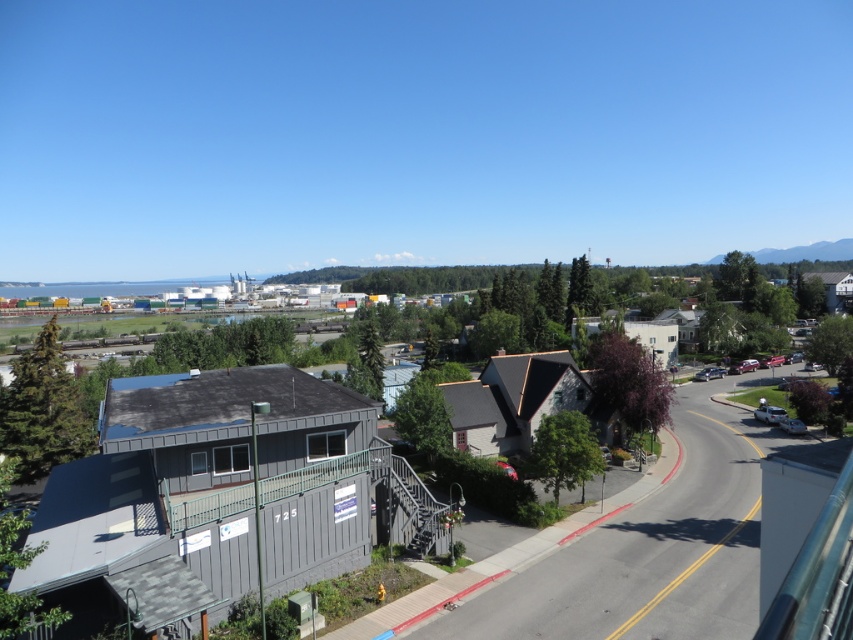
Question: Which point is farther to the camera?

Choices:
 (A) white glossy car at lower right
 (B) silver metallic sedan at lower right

Answer: (A)

Question: Does gray wood town at center lie in front of metallic silver sedan at center-right?

Choices:
 (A) yes
 (B) no

Answer: (A)

Question: Does metallic silver sedan at center-right have a lesser width compared to white glossy car at lower right?

Choices:
 (A) no
 (B) yes

Answer: (A)

Question: Among these objects, which one is farthest from the camera?

Choices:
 (A) metallic silver sedan at center-right
 (B) white glossy car at lower right
 (C) silver metallic sedan at lower right
 (D) gray wood town at center

Answer: (A)

Question: Does gray wood town at center have a smaller size compared to metallic silver sedan at center-right?

Choices:
 (A) yes
 (B) no

Answer: (B)

Question: Estimate the real-world distances between objects in this image. Which object is farther from the gray wood town at center?

Choices:
 (A) white glossy car at lower right
 (B) silver metallic sedan at lower right
 (C) metallic silver sedan at center-right

Answer: (C)